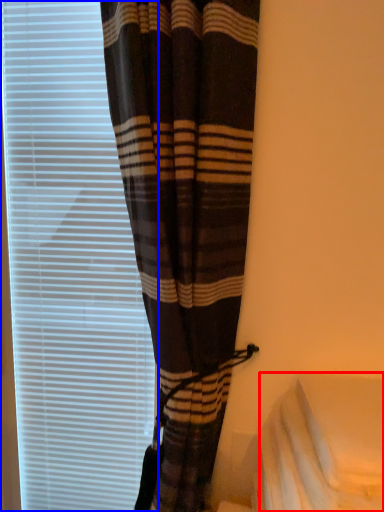
Question: Among these objects, which one is nearest to the camera, sheet (highlighted by a red box) or window blind (highlighted by a blue box)?

Choices:
 (A) sheet
 (B) window blind

Answer: (A)